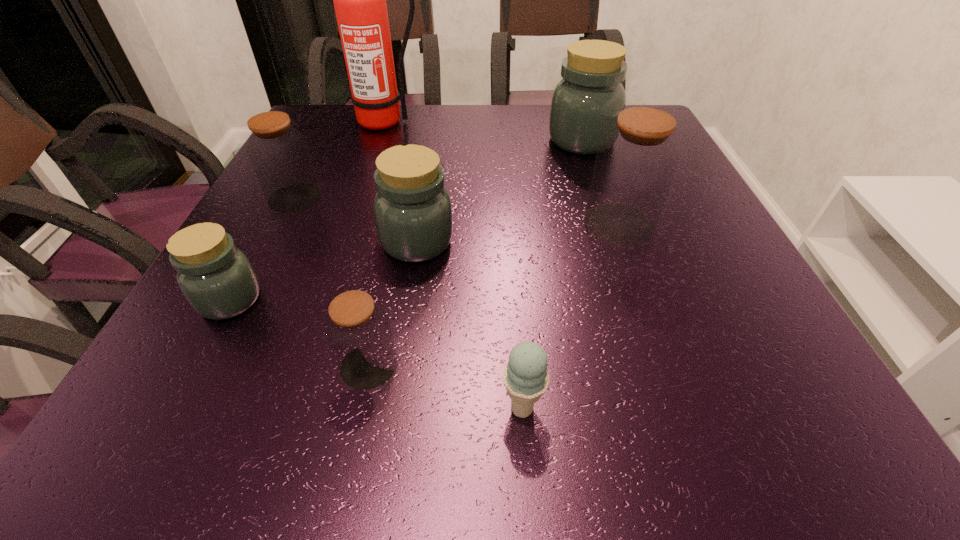
Find the location of a particular element. The height and width of the screenshot is (540, 960). free point located on the right of the second brown jar from left to right is located at coordinates pyautogui.click(x=564, y=366).

This screenshot has width=960, height=540. In order to click on vacant area situated on the back of the blue ice cream in this screenshot , I will do `click(510, 240)`.

Where is `fire extinguisher that is at the far edge`? Image resolution: width=960 pixels, height=540 pixels. fire extinguisher that is at the far edge is located at coordinates (359, 0).

This screenshot has height=540, width=960. Identify the location of jar positioned at the far edge. (590, 95).

I want to click on jar located at the near edge, so click(x=358, y=331).

The width and height of the screenshot is (960, 540). What are the coordinates of `ice cream situated at the near edge` in the screenshot? It's located at (525, 377).

At what (x,y) coordinates should I click in order to perform the action: click on fire extinguisher present at the left edge. Please return your answer as a coordinate pair (x, y). This screenshot has height=540, width=960. Looking at the image, I should click on (359, 0).

I want to click on object that is positioned at the far left corner, so click(359, 0).

You are a GUI agent. You are given a task and a screenshot of the screen. Output one action in this format:
    pyautogui.click(x=<x>, y=<y>)
    Task: Click on the object present at the far right corner
    The width and height of the screenshot is (960, 540).
    Given the screenshot: What is the action you would take?
    pyautogui.click(x=590, y=95)

The image size is (960, 540). What are the coordinates of `vacant space at the far edge of the desktop` in the screenshot? It's located at (528, 138).